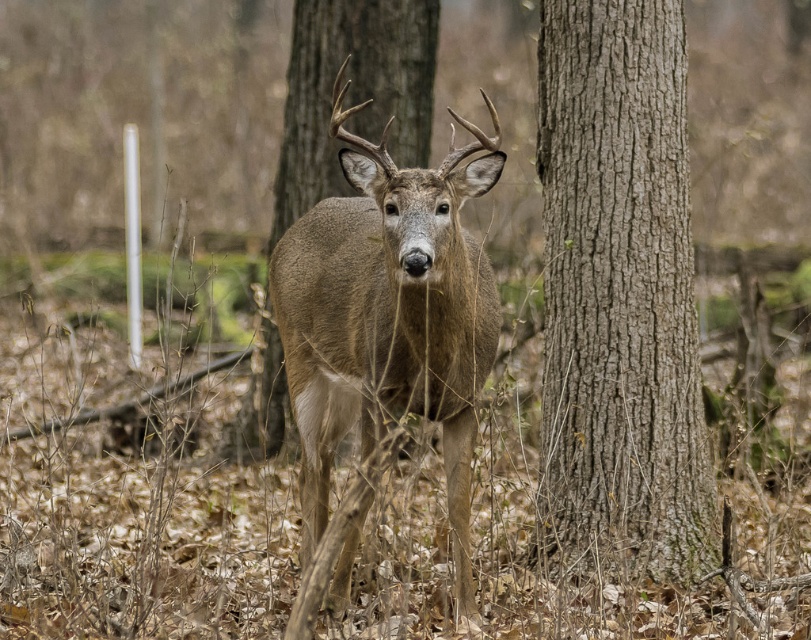
Question: From the image, what is the correct spatial relationship of gray textured bark at center in relation to brown rough bark tree at center?

Choices:
 (A) above
 (B) below

Answer: (B)

Question: Among these objects, which one is nearest to the camera?

Choices:
 (A) brown rough bark tree at center
 (B) gray textured bark at center

Answer: (B)

Question: Which is farther from the gray textured bark at center?

Choices:
 (A) brown rough bark tree at center
 (B) brown fur deer at center

Answer: (A)

Question: Is brown fur deer at center thinner than brown rough bark tree at center?

Choices:
 (A) yes
 (B) no

Answer: (A)

Question: Which of the following is the farthest from the observer?

Choices:
 (A) gray textured bark at center
 (B) brown rough bark tree at center
 (C) brown fur deer at center

Answer: (B)

Question: Considering the relative positions of gray textured bark at center and brown rough bark tree at center in the image provided, where is gray textured bark at center located with respect to brown rough bark tree at center?

Choices:
 (A) left
 (B) right

Answer: (B)